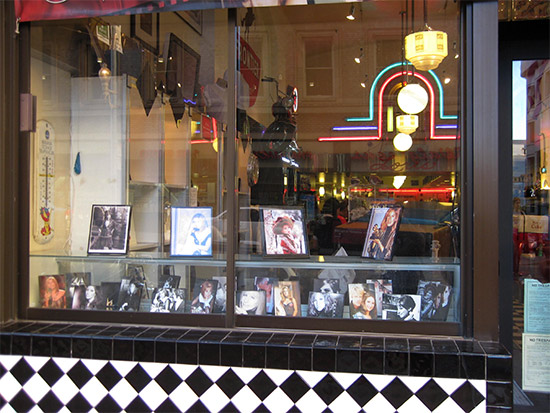
The width and height of the screenshot is (550, 413). What are the coordinates of `white tile` in the screenshot? It's located at (419, 409).